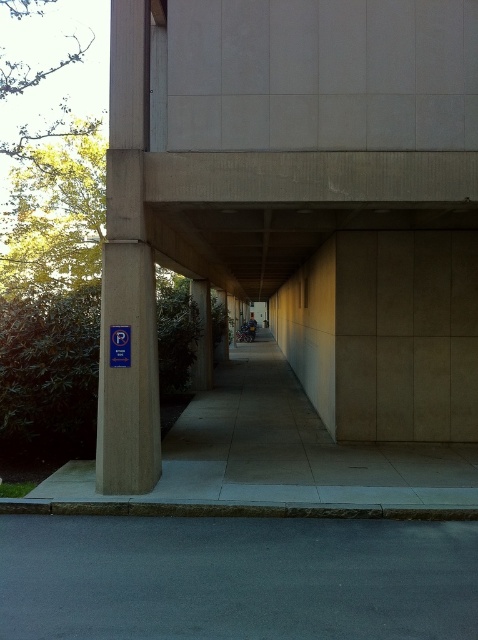
Which of these two, gray concrete pavement at center or beige concrete pillar at left, stands taller?

With more height is beige concrete pillar at left.

Between point (86, 464) and point (159, 401), which one is positioned behind?

Point (86, 464)

Image resolution: width=478 pixels, height=640 pixels. Identify the location of gray concrete pavement at center. (279, 456).

Can you confirm if dark gray asphalt at lower center is taller than blue plastic parking sign at left?

No.

Between point (191, 632) and point (125, 330), which one is positioned behind?

Point (125, 330)

Describe the element at coordinates (236, 579) in the screenshot. I see `dark gray asphalt at lower center` at that location.

You are a GUI agent. You are given a task and a screenshot of the screen. Output one action in this format:
    pyautogui.click(x=<x>, y=<y>)
    Task: Click on the dark gray asphalt at lower center
    The image size is (478, 640).
    Given the screenshot: What is the action you would take?
    pyautogui.click(x=236, y=579)

Can you confirm if concrete corridor at center is bigger than gray concrete pavement at center?

Yes, concrete corridor at center is bigger than gray concrete pavement at center.

Does concrete corridor at center have a lesser height compared to gray concrete pavement at center?

In fact, concrete corridor at center may be taller than gray concrete pavement at center.

Between point (270, 33) and point (195, 410), which one is positioned in front?

Point (270, 33) is more forward.

Image resolution: width=478 pixels, height=640 pixels. What are the coordinates of `concrete corridor at center` in the screenshot? It's located at (301, 205).